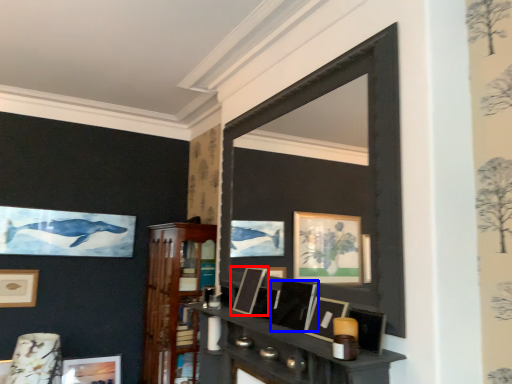
Question: Among these objects, which one is nearest to the camera, picture frame (highlighted by a red box) or picture frame (highlighted by a blue box)?

Choices:
 (A) picture frame
 (B) picture frame

Answer: (B)